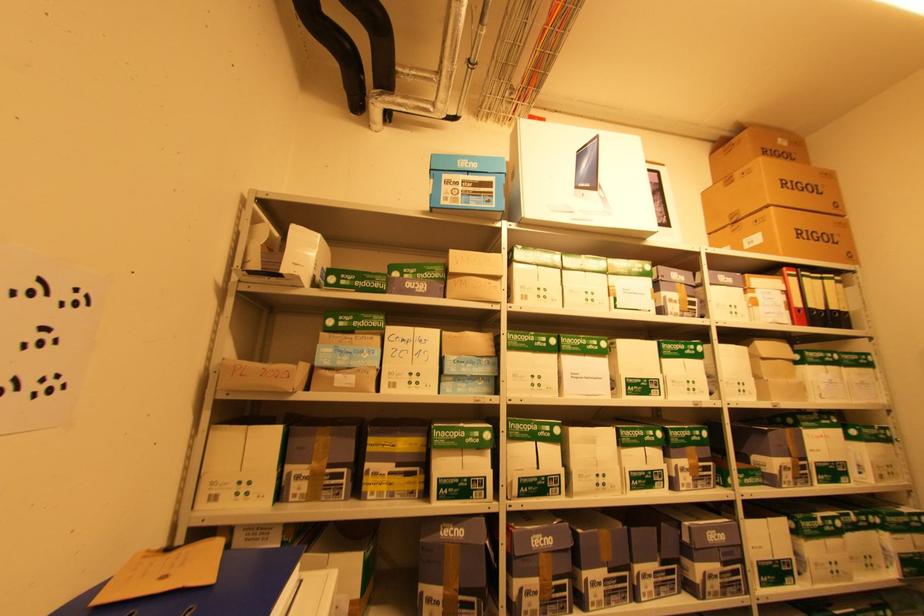
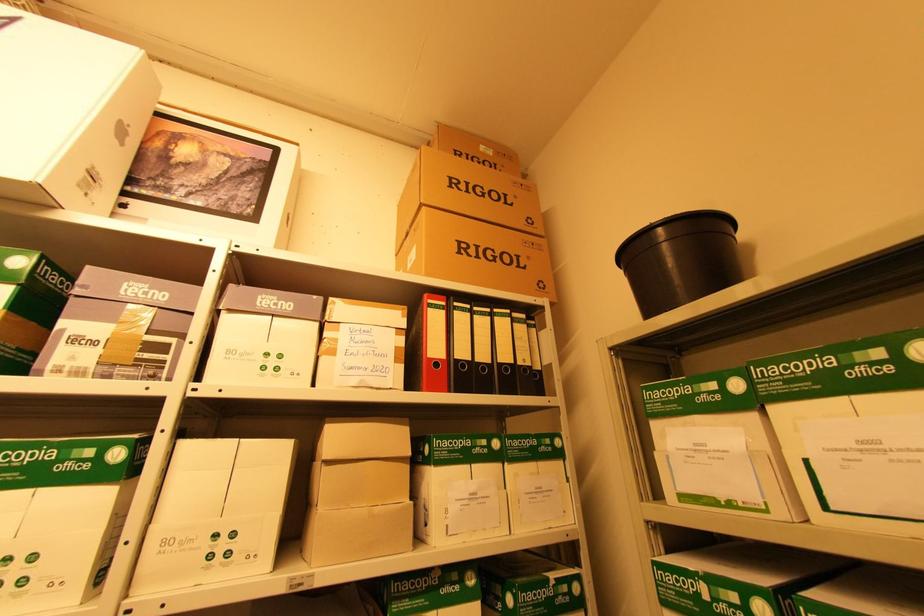
In a continuous first-person perspective shot, in which direction is the camera moving?

The cameraman walked toward right, forward.